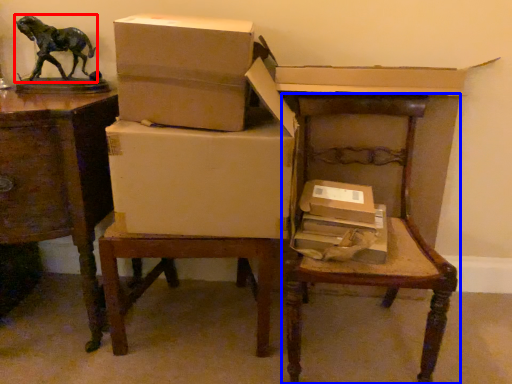
Question: Among these objects, which one is farthest to the camera, animal (highlighted by a red box) or chair (highlighted by a blue box)?

Choices:
 (A) animal
 (B) chair

Answer: (A)